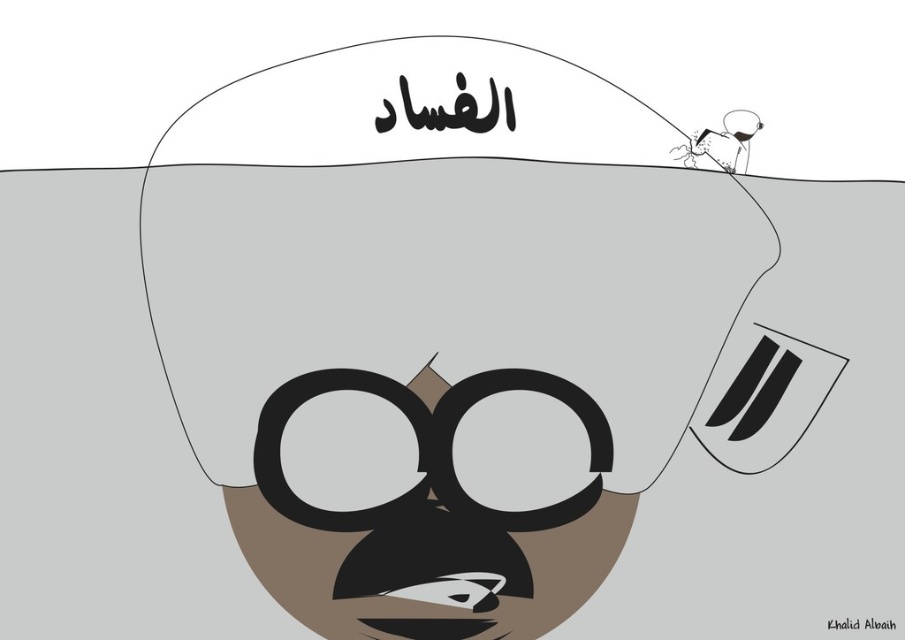
Question: Which object appears closest to the camera in this image?

Choices:
 (A) black matte goggles at center
 (B) white matte helmet at upper center

Answer: (B)

Question: Does black matte goggles at center lie behind smooth white figure at upper right?

Choices:
 (A) yes
 (B) no

Answer: (B)

Question: Considering the relative positions of white matte helmet at upper center and black matte goggles at center in the image provided, where is white matte helmet at upper center located with respect to black matte goggles at center?

Choices:
 (A) below
 (B) above

Answer: (B)

Question: Which point is closer to the camera taking this photo?

Choices:
 (A) (700, 156)
 (B) (558, 397)

Answer: (B)

Question: Can you confirm if white matte helmet at upper center is positioned above smooth white figure at upper right?

Choices:
 (A) yes
 (B) no

Answer: (B)

Question: Estimate the real-world distances between objects in this image. Which object is closer to the black matte goggles at center?

Choices:
 (A) smooth white figure at upper right
 (B) white matte helmet at upper center

Answer: (B)